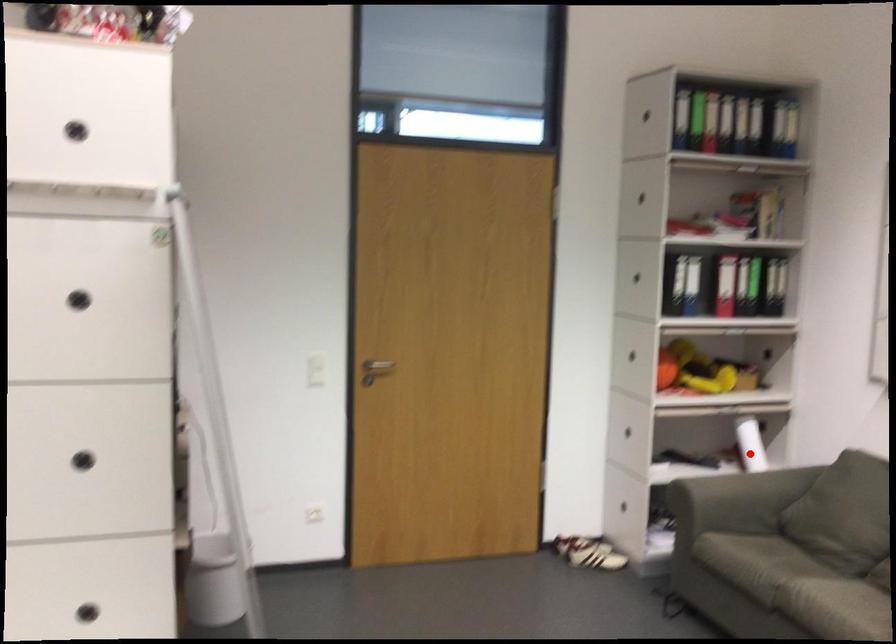
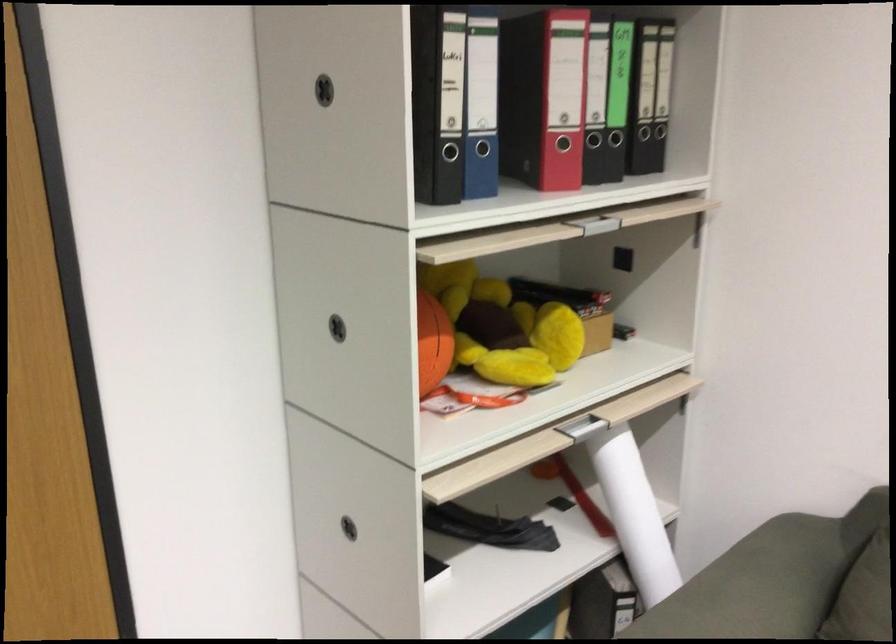
The point at the highlighted location is marked in the first image. Where is the corresponding point in the second image?

(633, 514)